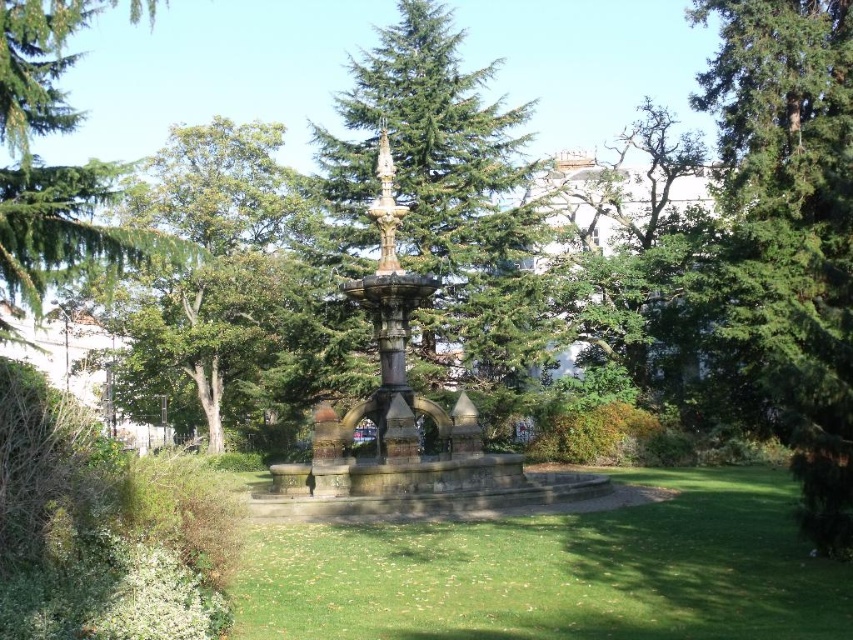
You are standing in the park and want to walk towards the fountain. There are two points marked on the ground, point (729, 560) and point (804, 291). Which point is closer to you as you face the fountain?

Point (729, 560) is closer to the viewer than point (804, 291).

You are standing at the edge of the park and want to walk towards the central ornate fountain. As you move forward, you notice a point marked at coordinates [556,572]. What is located at this point?

The point at [556,572] has green grass at center.